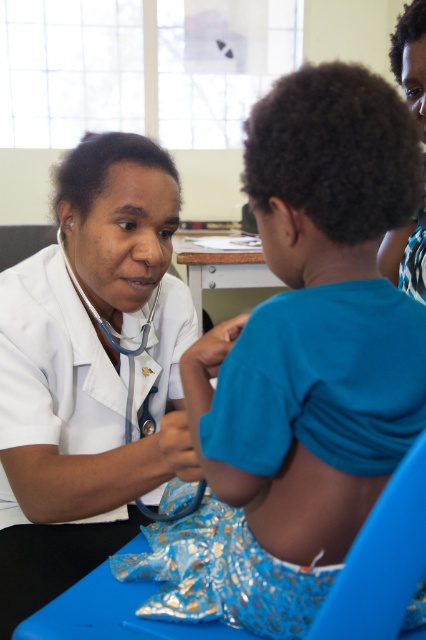
Consider the image. Which is more to the left, white smooth stethoscope at center or matte white coat at upper left?

white smooth stethoscope at center

Is white smooth stethoscope at center shorter than matte white coat at upper left?

No, white smooth stethoscope at center is not shorter than matte white coat at upper left.

The height and width of the screenshot is (640, 426). What do you see at coordinates (89, 371) in the screenshot? I see `white smooth stethoscope at center` at bounding box center [89, 371].

The height and width of the screenshot is (640, 426). I want to click on white smooth stethoscope at center, so click(x=89, y=371).

Is matte white coat at upper left shorter than blue rubber stethoscope at left?

No.

Is matte white coat at upper left thinner than blue rubber stethoscope at left?

Correct, matte white coat at upper left's width is less than blue rubber stethoscope at left's.

Which is behind, point (414, 64) or point (71, 269)?

The point (414, 64) is more distant.

This screenshot has width=426, height=640. I want to click on matte white coat at upper left, so click(411, 58).

Does white smooth stethoscope at center appear on the right side of blue rubber stethoscope at left?

Indeed, white smooth stethoscope at center is positioned on the right side of blue rubber stethoscope at left.

Measure the distance between white smooth stethoscope at center and camera.

white smooth stethoscope at center and camera are 34.00 inches apart.

The width and height of the screenshot is (426, 640). Find the location of `white smooth stethoscope at center`. white smooth stethoscope at center is located at coordinates (89, 371).